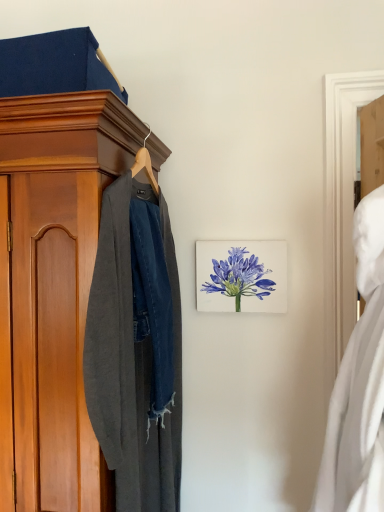
Where is `white matte dress at right`? The height and width of the screenshot is (512, 384). white matte dress at right is located at coordinates (359, 384).

Which is behind, watercolor blue flower at center or white matte dress at right?

watercolor blue flower at center is behind.

Can you tell me how much watercolor blue flower at center and white matte dress at right differ in facing direction?

watercolor blue flower at center and white matte dress at right are facing 78.4 degrees away from each other.

Based on the photo, is watercolor blue flower at center in contact with white matte dress at right?

watercolor blue flower at center and white matte dress at right are clearly separated.

The width and height of the screenshot is (384, 512). I want to click on flower behind the white matte dress at right, so click(x=239, y=277).

From a real-world perspective, which object stands above the other?

From a 3D spatial view, white matte dress at right is above.

Is dark gray wool coat at left looking in the opposite direction of white matte dress at right?

Absolutely, dark gray wool coat at left is directed away from white matte dress at right.

Consider the image. Between dark gray wool coat at left and white matte dress at right, which one is positioned in front?

Positioned in front is white matte dress at right.

Find the location of a particular element. The image size is (384, 512). dress that appears on the right of dark gray wool coat at left is located at coordinates (359, 384).

Does point (381, 463) lie in front of point (163, 293)?

Yes, it is in front of point (163, 293).

Does white matte dress at right appear on the right side of dark gray wool coat at left?

Yes.

Consider the image. From a real-world perspective, is white matte dress at right physically located above or below dark gray wool coat at left?

white matte dress at right is above dark gray wool coat at left.

Does watercolor blue flower at center have a lesser height compared to dark gray wool coat at left?

Yes.

In the scene shown: From the image's perspective, which one is positioned lower, watercolor blue flower at center or dark gray wool coat at left?

dark gray wool coat at left appears lower in the image.

Does watercolor blue flower at center have a smaller size compared to dark gray wool coat at left?

Yes, watercolor blue flower at center is smaller than dark gray wool coat at left.

Is watercolor blue flower at center not inside dark gray wool coat at left?

Absolutely, watercolor blue flower at center is external to dark gray wool coat at left.

Considering the positions of objects dark gray wool coat at left and watercolor blue flower at center in the image provided, who is more to the right, dark gray wool coat at left or watercolor blue flower at center?

watercolor blue flower at center is more to the right.

Between dark gray wool coat at left and watercolor blue flower at center, which one has more height?

Standing taller between the two is dark gray wool coat at left.

Is the surface of dark gray wool coat at left in direct contact with watercolor blue flower at center?

No, dark gray wool coat at left is not beside watercolor blue flower at center.

Is dark gray wool coat at left turned away from watercolor blue flower at center?

No, watercolor blue flower at center is not at the back of dark gray wool coat at left.

Does white matte dress at right have a greater width compared to watercolor blue flower at center?

Yes.

From the image's perspective, would you say white matte dress at right is shown under watercolor blue flower at center?

Yes, from the image's perspective, white matte dress at right is below watercolor blue flower at center.

Considering the sizes of objects white matte dress at right and watercolor blue flower at center in the image provided, who is smaller, white matte dress at right or watercolor blue flower at center?

Smaller between the two is watercolor blue flower at center.

How different are the orientations of white matte dress at right and watercolor blue flower at center in degrees?

There is a 78.4-degree angle between the facing directions of white matte dress at right and watercolor blue flower at center.

At what (x,y) coordinates should I click in order to perform the action: click on flower that is above the white matte dress at right (from a real-world perspective). Please return your answer as a coordinate pair (x, y). The height and width of the screenshot is (512, 384). Looking at the image, I should click on (239, 277).

Image resolution: width=384 pixels, height=512 pixels. Identify the location of clothing below the white matte dress at right (from the image's perspective). (136, 348).

Which object lies nearer to the anchor point white matte dress at right, watercolor blue flower at center or dark gray wool coat at left?

Among the two, dark gray wool coat at left is located nearer to white matte dress at right.

From the image, which object appears to be farther from watercolor blue flower at center, dark gray wool coat at left or white matte dress at right?

The object further to watercolor blue flower at center is white matte dress at right.

From the image, which object appears to be farther from white matte dress at right, dark gray wool coat at left or watercolor blue flower at center?

Among the two, watercolor blue flower at center is located further to white matte dress at right.

Estimate the real-world distances between objects in this image. Which object is further from dark gray wool coat at left, white matte dress at right or watercolor blue flower at center?

white matte dress at right.

Estimate the real-world distances between objects in this image. Which object is closer to watercolor blue flower at center, white matte dress at right or dark gray wool coat at left?

dark gray wool coat at left is closer to watercolor blue flower at center.

Based on their spatial positions, is watercolor blue flower at center or white matte dress at right further from dark gray wool coat at left?

white matte dress at right lies further to dark gray wool coat at left than the other object.

At what (x,y) coordinates should I click in order to perform the action: click on clothing positioned between white matte dress at right and watercolor blue flower at center from near to far. Please return your answer as a coordinate pair (x, y). The image size is (384, 512). Looking at the image, I should click on (136, 348).